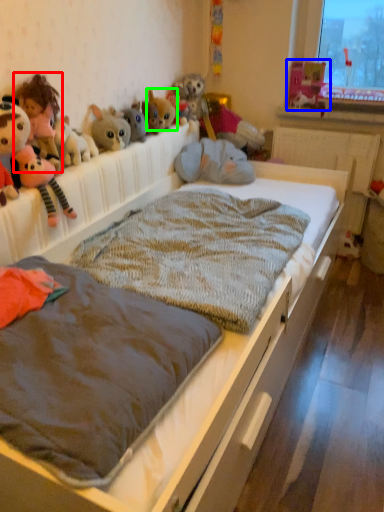
Question: Estimate the real-world distances between objects in this image. Which object is closer to child (highlighted by a red box), toy (highlighted by a blue box) or toy (highlighted by a green box)?

Choices:
 (A) toy
 (B) toy

Answer: (B)